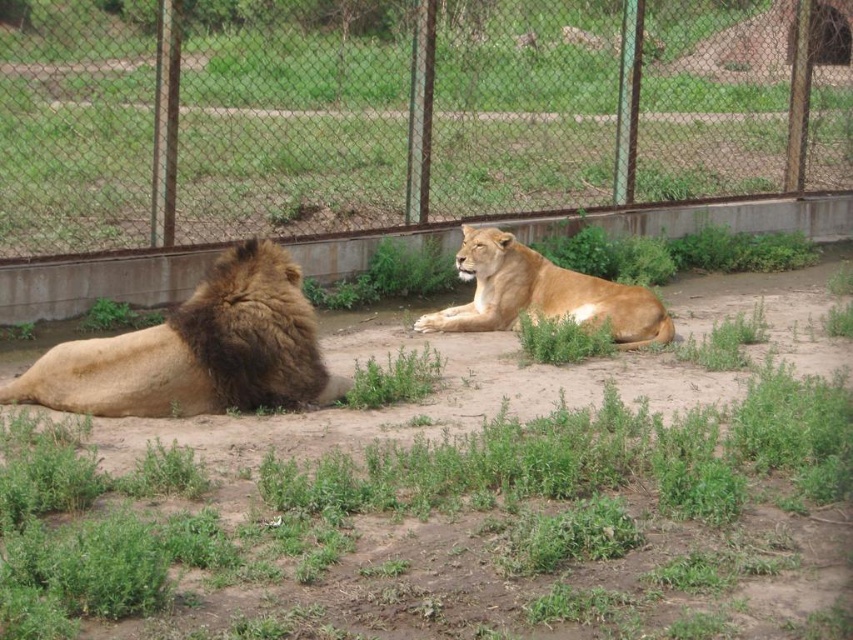
You are a zookeeper planning to install a new feeding station in the enclosure. The feeding station requires a space that is larger than the metal mesh fence at upper center. Can the golden fur lion at center be used as a reference point to determine if the space is sufficient?

The metal mesh fence at upper center is smaller than the golden fur lion at center, so the space required for the feeding station must be larger than the lion. Since the golden fur lion at center is larger, using it as a reference would ensure the space is sufficient.

You are a zookeeper standing at the entrance of the enclosure. You need to locate the metal mesh fence at upper center to check its condition. Based on the coordinates provided, where should you look relative to the lions?

The metal mesh fence at upper center is located at coordinates point [401,113], which means it is positioned near the upper part of the enclosure, between the two lions.

You are a zookeeper planning to place a new feeding tray in the enclosure. The golden fur lion at left is currently resting at position coordinates. To ensure the tray is accessible but not too close to the lion, where should you place it relative to the lion?

The golden fur lion at left is located at point (196, 349). To place the feeding tray accessible but not too close, position it slightly to the right and above the lion to maintain a safe distance while ensuring visibility.